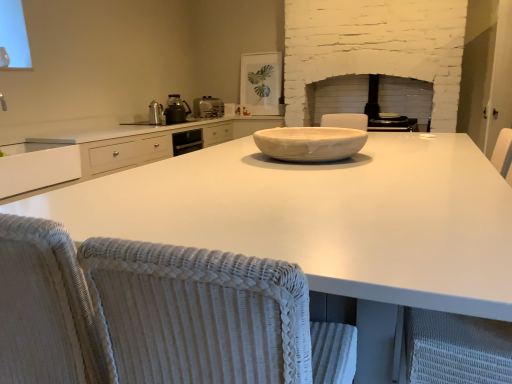
What are the coordinates of `white matte cabinet at left` in the screenshot? It's located at (37, 167).

Locate an element on the screen. Image resolution: width=512 pixels, height=384 pixels. white woven armchair at right is located at coordinates (456, 348).

In order to click on white glossy countertop at center in this screenshot , I will do `click(322, 217)`.

The image size is (512, 384). In order to click on white marble bowl at center in this screenshot , I will do `click(310, 143)`.

The height and width of the screenshot is (384, 512). What are the coordinates of `satin silver toaster at upper center` in the screenshot? It's located at (208, 107).

Describe the element at coordinates (176, 110) in the screenshot. I see `metallic black kettle at upper left, which is the second appliance in back-to-front order` at that location.

What is the approximate height of matte black toaster at center, which ranks as the 2th appliance in front-to-back order?

matte black toaster at center, which ranks as the 2th appliance in front-to-back order, is 5.06 inches in height.

This screenshot has height=384, width=512. Find the location of `white matte cabinet at left`. white matte cabinet at left is located at coordinates (37, 167).

From a real-world perspective, who is located lower, metallic black kettle at upper left, which is the 3th appliance in right-to-left order, or white woven swivel chair at lower left?

white woven swivel chair at lower left is physically lower.

Which object is further away from the camera taking this photo, metallic black kettle at upper left, which is the 3th appliance from front to back, or white woven swivel chair at lower left?

metallic black kettle at upper left, which is the 3th appliance from front to back, is further away from the camera.

Does point (170, 118) come behind point (258, 345)?

Yes, point (170, 118) is farther from viewer.

Is metallic black kettle at upper left, the 2th appliance when ordered from left to right, far from white woven swivel chair at lower left?

metallic black kettle at upper left, the 2th appliance when ordered from left to right, is positioned a significant distance from white woven swivel chair at lower left.

Considering the points (198, 114) and (203, 327), which point is in front, point (198, 114) or point (203, 327)?

The point (203, 327) is in front.

Is white woven swivel chair at lower left surrounded by satin silver toaster at upper center?

Definitely not — white woven swivel chair at lower left is not inside satin silver toaster at upper center.

Does satin silver toaster at upper center lie behind white woven swivel chair at lower left?

Yes, the depth of satin silver toaster at upper center is greater than that of white woven swivel chair at lower left.

Which of these two, satin silver toaster at upper center or white woven swivel chair at lower left, is bigger?

With larger size is white woven swivel chair at lower left.

Looking at this image, from the image's perspective, is matte white frame at upper center, which ranks as the fourth appliance in front-to-back order, beneath white woven swivel chair at lower left?

No, from the image's perspective, matte white frame at upper center, which ranks as the fourth appliance in front-to-back order, is not below white woven swivel chair at lower left.

From a real-world perspective, which is physically above, matte white frame at upper center, which ranks as the fourth appliance in front-to-back order, or white woven swivel chair at lower left?

matte white frame at upper center, which ranks as the fourth appliance in front-to-back order, is physically above.

You are a GUI agent. You are given a task and a screenshot of the screen. Output one action in this format:
    pyautogui.click(x=<x>, y=<y>)
    Task: Click on the swivel chair on the left of matte white frame at upper center, the 1th appliance when ordered from back to front
    Image resolution: width=512 pixels, height=384 pixels.
    Given the screenshot: What is the action you would take?
    pyautogui.click(x=209, y=317)

Is point (254, 81) positioned before point (131, 258)?

No, (254, 81) is behind (131, 258).

Consider the image. In terms of width, does satin silver toaster at upper center look wider or thinner when compared to white matte cabinet at left?

satin silver toaster at upper center is thinner than white matte cabinet at left.

Do you think satin silver toaster at upper center is within white matte cabinet at left, or outside of it?

satin silver toaster at upper center exists outside the volume of white matte cabinet at left.

Consider the image. From the image's perspective, is satin silver toaster at upper center located above or below white matte cabinet at left?

Clearly, from the image's perspective, satin silver toaster at upper center is above white matte cabinet at left.

Find the location of a particular element. The height and width of the screenshot is (384, 512). kitchen appliance on the right of white matte cabinet at left is located at coordinates (208, 107).

Based on the photo, is metallic silver kettle at center-left, placed as the 4th appliance when sorted from right to left, turned away from white woven armchair at right?

No, metallic silver kettle at center-left, placed as the 4th appliance when sorted from right to left, is not facing the opposite direction of white woven armchair at right.

Considering the sizes of objects metallic silver kettle at center-left, which is the 1th appliance in left-to-right order, and white woven armchair at right in the image provided, who is shorter, metallic silver kettle at center-left, which is the 1th appliance in left-to-right order, or white woven armchair at right?

With less height is metallic silver kettle at center-left, which is the 1th appliance in left-to-right order.

In the scene shown: In the image, is metallic silver kettle at center-left, the fourth appliance from the back, on the left side or the right side of white woven armchair at right?

In the image, metallic silver kettle at center-left, the fourth appliance from the back, appears on the left side of white woven armchair at right.

Considering the sizes of metallic silver kettle at center-left, placed as the 4th appliance when sorted from right to left, and white woven armchair at right in the image, is metallic silver kettle at center-left, placed as the 4th appliance when sorted from right to left, bigger or smaller than white woven armchair at right?

metallic silver kettle at center-left, placed as the 4th appliance when sorted from right to left, is smaller than white woven armchair at right.

Which point is more forward, (196, 294) or (184, 113)?

The point (196, 294) is closer.

Can you confirm if white woven swivel chair at lower left is thinner than metallic black kettle at upper left, which is the 3th appliance from front to back?

No, white woven swivel chair at lower left is not thinner than metallic black kettle at upper left, which is the 3th appliance from front to back.

How many degrees apart are the facing directions of white woven swivel chair at lower left and metallic black kettle at upper left, which is the 3th appliance from front to back?

There is a 90.7-degree angle between the facing directions of white woven swivel chair at lower left and metallic black kettle at upper left, which is the 3th appliance from front to back.

From a real-world perspective, is white glossy countertop at center above or below white matte cabinet at left?

In terms of real-world spatial position, white glossy countertop at center is below white matte cabinet at left.

Which object is closer to the camera taking this photo, white glossy countertop at center or white matte cabinet at left?

white glossy countertop at center is in front.

Between white glossy countertop at center and white matte cabinet at left, which one appears on the left side from the viewer's perspective?

white matte cabinet at left is more to the left.

From the image's perspective, is white glossy countertop at center positioned above or below white matte cabinet at left?

Based on their image positions, white glossy countertop at center is located beneath white matte cabinet at left.

This screenshot has height=384, width=512. Identify the location of swivel chair below the metallic black kettle at upper left, the 2th appliance when ordered from left to right (from a real-world perspective). (209, 317).

The image size is (512, 384). Identify the location of swivel chair on the right side of satin silver toaster at upper center. coord(209,317).

Based on their spatial positions, is white woven swivel chair at lower left or metallic silver kettle at center-left, the fourth appliance from the back, further from matte black toaster at center, placed as the third appliance when sorted from back to front?

white woven swivel chair at lower left is positioned further to the anchor matte black toaster at center, placed as the third appliance when sorted from back to front.

When comparing their distances from metallic silver kettle at center-left, the fourth appliance from the back, does white woven swivel chair at lower left or metallic black kettle at upper left, which is the 3th appliance in right-to-left order, seem closer?

metallic black kettle at upper left, which is the 3th appliance in right-to-left order, is closer to metallic silver kettle at center-left, the fourth appliance from the back.

Based on their spatial positions, is white marble bowl at center or metallic black kettle at upper left, which is the second appliance in back-to-front order, further from matte white frame at upper center, which ranks as the fourth appliance in front-to-back order?

white marble bowl at center is positioned further to the anchor matte white frame at upper center, which ranks as the fourth appliance in front-to-back order.

From the image, which object appears to be nearer to white glossy countertop at center, matte white frame at upper center, the second appliance positioned from the right, or white marble bowl at center?

white marble bowl at center lies closer to white glossy countertop at center than the other object.

Considering their positions, is metallic black kettle at upper left, which is the 3th appliance from front to back, positioned further to metallic silver kettle at center-left, the 1th appliance viewed from the front, than white woven swivel chair at lower left?

The object further to metallic silver kettle at center-left, the 1th appliance viewed from the front, is white woven swivel chair at lower left.

When comparing their distances from matte black toaster at center, which is the 4th appliance from left to right, does white marble bowl at center or white glossy countertop at center seem further?

The object further to matte black toaster at center, which is the 4th appliance from left to right, is white glossy countertop at center.

From the image, which object appears to be farther from metallic black kettle at upper left, which is the 3th appliance in right-to-left order, white woven armchair at right or white glossy countertop at center?

white woven armchair at right is positioned further to the anchor metallic black kettle at upper left, which is the 3th appliance in right-to-left order.

Looking at the image, which one is located further to white marble bowl at center, metallic silver kettle at center-left, the 1th appliance viewed from the front, or matte black toaster at center, which ranks as the 2th appliance in front-to-back order?

metallic silver kettle at center-left, the 1th appliance viewed from the front, is further to white marble bowl at center.

Identify the location of countertop between white woven swivel chair at lower left and white matte cabinet at left from front to back. (322, 217).

At what (x,y) coordinates should I click in order to perform the action: click on armchair between white glossy countertop at center and matte white frame at upper center, which ranks as the 3th appliance in left-to-right order, along the z-axis. Please return your answer as a coordinate pair (x, y). The image size is (512, 384). Looking at the image, I should click on [x=456, y=348].

The image size is (512, 384). Find the location of `countertop between white woven swivel chair at lower left and white marble bowl at center from front to back`. countertop between white woven swivel chair at lower left and white marble bowl at center from front to back is located at coordinates (322, 217).

You are a GUI agent. You are given a task and a screenshot of the screen. Output one action in this format:
    pyautogui.click(x=<x>, y=<y>)
    Task: Click on the appliance between white woven armchair at right and matte black toaster at center, which ranks as the 2th appliance in front-to-back order, in the front-back direction
    
    Given the screenshot: What is the action you would take?
    pyautogui.click(x=155, y=113)